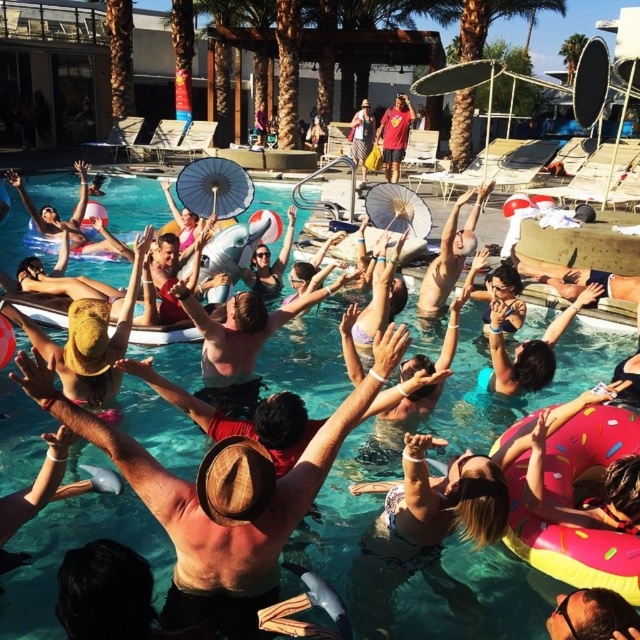
Which is more to the right, smooth skin man at center or reddish-brown fabric shorts at upper center?

reddish-brown fabric shorts at upper center

Who is higher up, smooth skin man at center or reddish-brown fabric shorts at upper center?

reddish-brown fabric shorts at upper center is higher up.

Is point (467, 230) positioned after point (394, 152)?

No, it is in front of (394, 152).

Image resolution: width=640 pixels, height=640 pixels. Find the location of `smooth skin man at center`. smooth skin man at center is located at coordinates (451, 253).

Is smooth skin man at center in front of smooth tan skin at upper center?

No, smooth skin man at center is further to the viewer.

Does smooth skin man at center have a larger size compared to smooth tan skin at upper center?

Correct, smooth skin man at center is larger in size than smooth tan skin at upper center.

Where is `smooth skin man at center`? The height and width of the screenshot is (640, 640). smooth skin man at center is located at coordinates (451, 253).

Is smooth skin man at center smaller than matte paper parasol at upper center?

No.

Where is `smooth skin man at center`? The image size is (640, 640). smooth skin man at center is located at coordinates (451, 253).